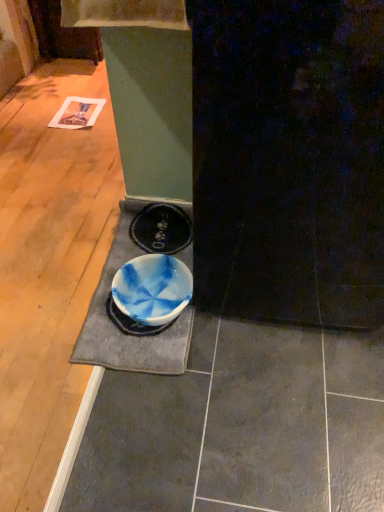
Where is `free space to the right of blue marbled bowl at center`? This screenshot has width=384, height=512. free space to the right of blue marbled bowl at center is located at coordinates pyautogui.click(x=233, y=335).